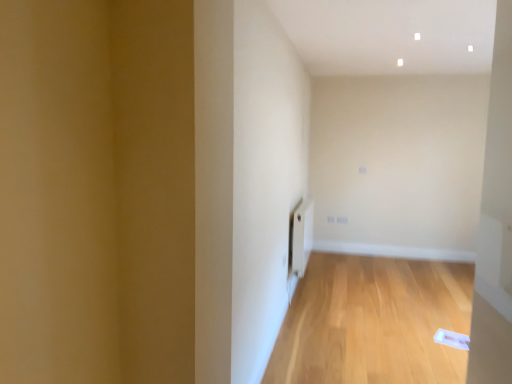
Question: Should I look upward or downward to see light wood floor at center?

Choices:
 (A) down
 (B) up

Answer: (A)

Question: Considering the relative sizes of white matte radiator at center and light wood floor at center in the image provided, is white matte radiator at center taller than light wood floor at center?

Choices:
 (A) yes
 (B) no

Answer: (A)

Question: Is white matte radiator at center behind light wood floor at center?

Choices:
 (A) no
 (B) yes

Answer: (B)

Question: From the image's perspective, is white matte radiator at center on top of light wood floor at center?

Choices:
 (A) no
 (B) yes

Answer: (B)

Question: Does white matte radiator at center touch light wood floor at center?

Choices:
 (A) yes
 (B) no

Answer: (B)

Question: From the image's perspective, is white matte radiator at center beneath light wood floor at center?

Choices:
 (A) yes
 (B) no

Answer: (B)

Question: Is white matte radiator at center positioned with its back to light wood floor at center?

Choices:
 (A) yes
 (B) no

Answer: (B)

Question: From the image's perspective, is light wood floor at center above white matte radiator at center?

Choices:
 (A) yes
 (B) no

Answer: (B)

Question: Does light wood floor at center appear on the left side of white matte radiator at center?

Choices:
 (A) no
 (B) yes

Answer: (A)

Question: Is light wood floor at center smaller than white matte radiator at center?

Choices:
 (A) no
 (B) yes

Answer: (A)

Question: Is light wood floor at center facing away from white matte radiator at center?

Choices:
 (A) yes
 (B) no

Answer: (B)

Question: From the image's perspective, would you say light wood floor at center is shown under white matte radiator at center?

Choices:
 (A) yes
 (B) no

Answer: (A)

Question: Is light wood floor at center not within white matte radiator at center?

Choices:
 (A) no
 (B) yes

Answer: (B)

Question: From a real-world perspective, relative to white matte radiator at center, is light wood floor at center vertically above or below?

Choices:
 (A) above
 (B) below

Answer: (B)